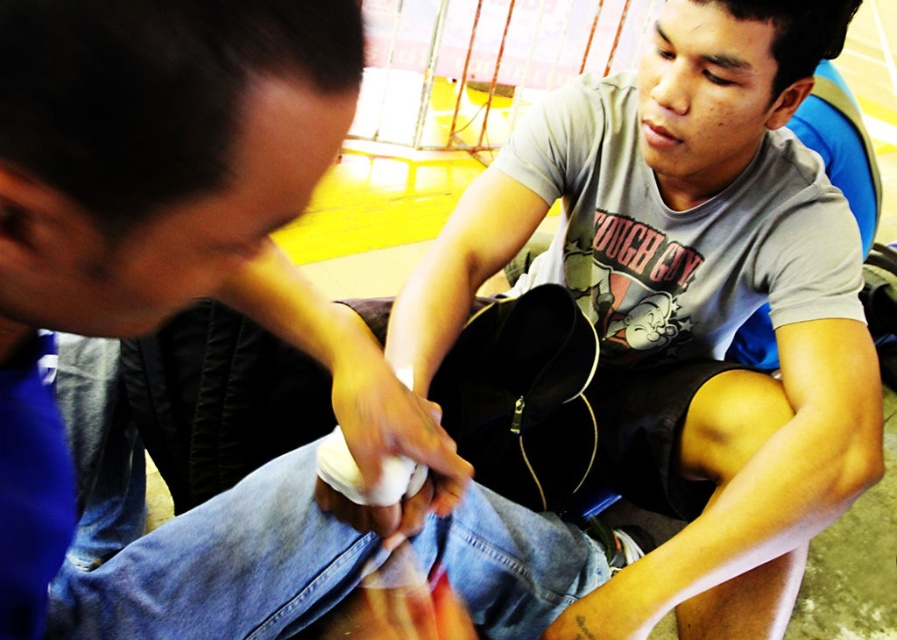
Is gray matte t-shirt at upper center thinner than matte gray t-shirt at center?

Yes, gray matte t-shirt at upper center is thinner than matte gray t-shirt at center.

You are a GUI agent. You are given a task and a screenshot of the screen. Output one action in this format:
    pyautogui.click(x=<x>, y=<y>)
    Task: Click on the gray matte t-shirt at upper center
    Image resolution: width=897 pixels, height=640 pixels.
    Given the screenshot: What is the action you would take?
    pyautogui.click(x=190, y=301)

Is point (173, 292) positioned before point (652, 208)?

Yes.

Where is `gray matte t-shirt at upper center`? The height and width of the screenshot is (640, 897). gray matte t-shirt at upper center is located at coordinates (190, 301).